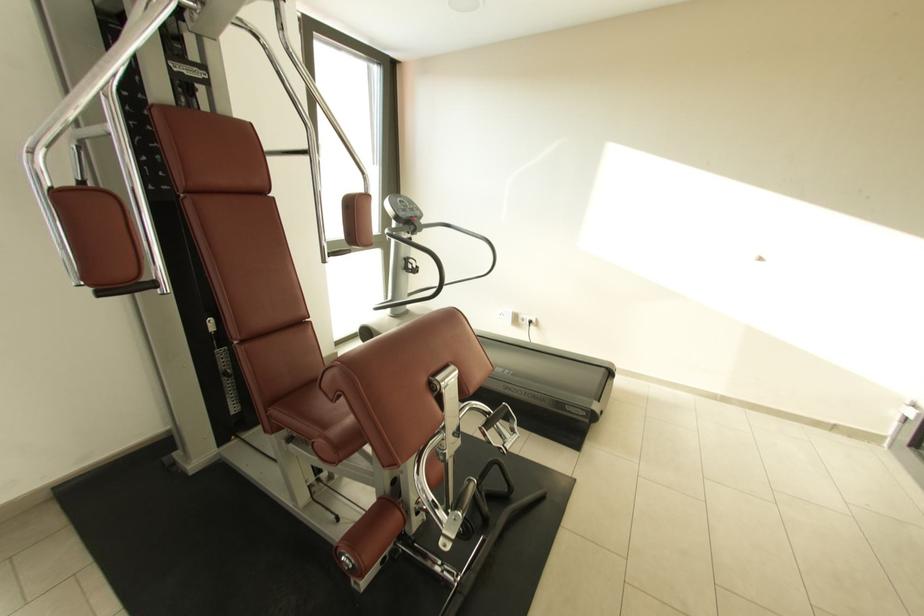
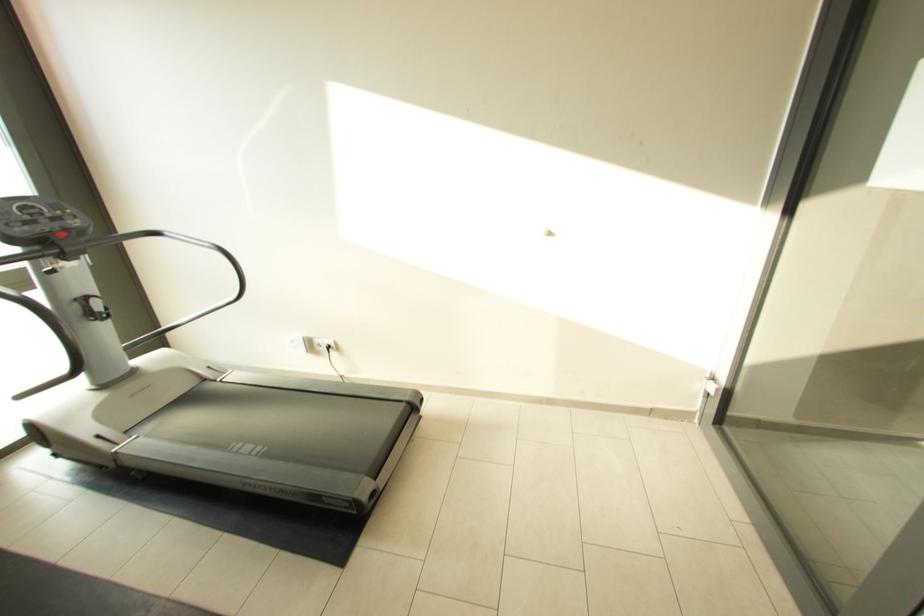
Find the pixel in the second image that matches (x=416, y=217) in the first image.

(54, 232)